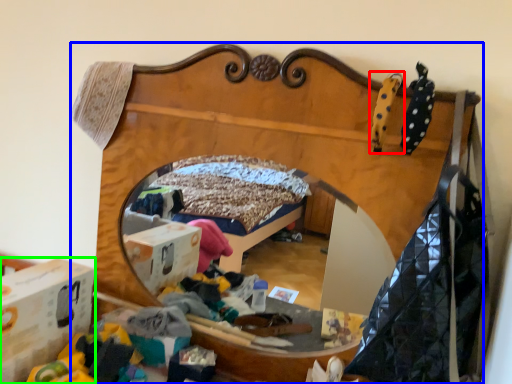
Question: Considering the real-world distances, which object is farthest from toy (highlighted by a red box)? furniture (highlighted by a blue box) or cardboard box (highlighted by a green box)?

Choices:
 (A) furniture
 (B) cardboard box

Answer: (B)